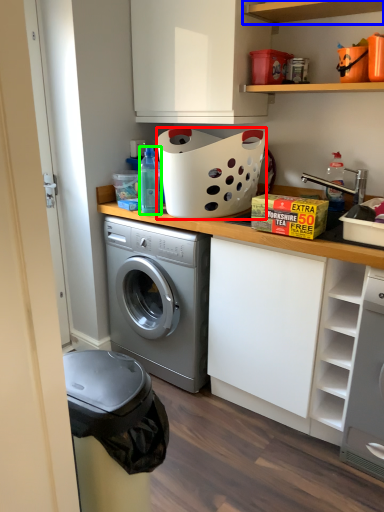
Question: Based on their relative distances, which object is farther from basket (highlighted by a red box)? Choose from shelf (highlighted by a blue box) and bottle (highlighted by a green box).

Choices:
 (A) shelf
 (B) bottle

Answer: (A)